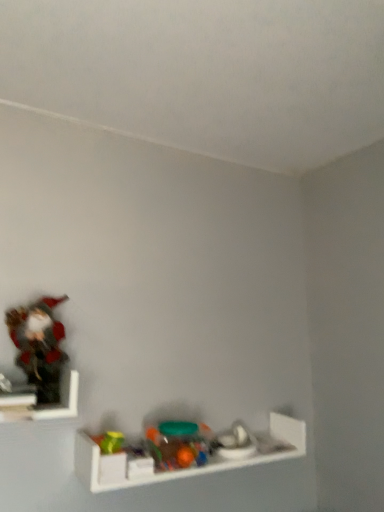
Question: Does translucent plastic toy at lower center, the first toy positioned from the right, have a lesser width compared to wooden figurine at left, which is counted as the first shelf, starting from the left?

Choices:
 (A) yes
 (B) no

Answer: (A)

Question: Does translucent plastic toy at lower center, the first toy positioned from the right, appear on the right side of wooden figurine at left, which is counted as the first shelf, starting from the left?

Choices:
 (A) yes
 (B) no

Answer: (A)

Question: Does translucent plastic toy at lower center, the first toy positioned from the right, turn towards wooden figurine at left, the 1th shelf when ordered from top to bottom?

Choices:
 (A) no
 (B) yes

Answer: (A)

Question: Does translucent plastic toy at lower center, the first toy positioned from the right, have a greater height compared to wooden figurine at left, which is counted as the first shelf, starting from the left?

Choices:
 (A) no
 (B) yes

Answer: (A)

Question: From the image's perspective, does translucent plastic toy at lower center, which is counted as the 3th toy, starting from the top, appear higher than wooden figurine at left, which is counted as the first shelf, starting from the left?

Choices:
 (A) no
 (B) yes

Answer: (A)

Question: Considering the relative positions of translucent plastic toy at lower center, placed as the third toy when sorted from left to right, and wooden figurine at left, which ranks as the 2th shelf in bottom-to-top order, in the image provided, is translucent plastic toy at lower center, placed as the third toy when sorted from left to right, behind wooden figurine at left, which ranks as the 2th shelf in bottom-to-top order,?

Choices:
 (A) no
 (B) yes

Answer: (B)

Question: Could matte plastic figurine at left, acting as the 1th toy starting from the left, be considered to be inside wooden figurine at left, which is counted as the first shelf, starting from the left?

Choices:
 (A) yes
 (B) no

Answer: (B)

Question: From a real-world perspective, is wooden figurine at left, which is counted as the first shelf, starting from the left, positioned over matte plastic figurine at left, the 3th toy viewed from the right, based on gravity?

Choices:
 (A) no
 (B) yes

Answer: (A)

Question: Does wooden figurine at left, marked as the second shelf in a right-to-left arrangement, lie in front of matte plastic figurine at left, the 3th toy viewed from the right?

Choices:
 (A) yes
 (B) no

Answer: (A)

Question: Is wooden figurine at left, the 1th shelf when ordered from top to bottom, facing towards matte plastic figurine at left, the 3th toy viewed from the right?

Choices:
 (A) yes
 (B) no

Answer: (A)

Question: Is wooden figurine at left, which ranks as the 2th shelf in bottom-to-top order, taller than matte plastic figurine at left, positioned as the 3th toy in bottom-to-top order?

Choices:
 (A) no
 (B) yes

Answer: (A)

Question: Would you consider wooden figurine at left, marked as the second shelf in a right-to-left arrangement, to be distant from matte plastic figurine at left, the 3th toy viewed from the right?

Choices:
 (A) no
 (B) yes

Answer: (A)

Question: Is translucent plastic toy at lower center, placed as the third toy when sorted from left to right, a part of translucent plastic toys at center, which is counted as the second toy, starting from the bottom?

Choices:
 (A) no
 (B) yes

Answer: (A)